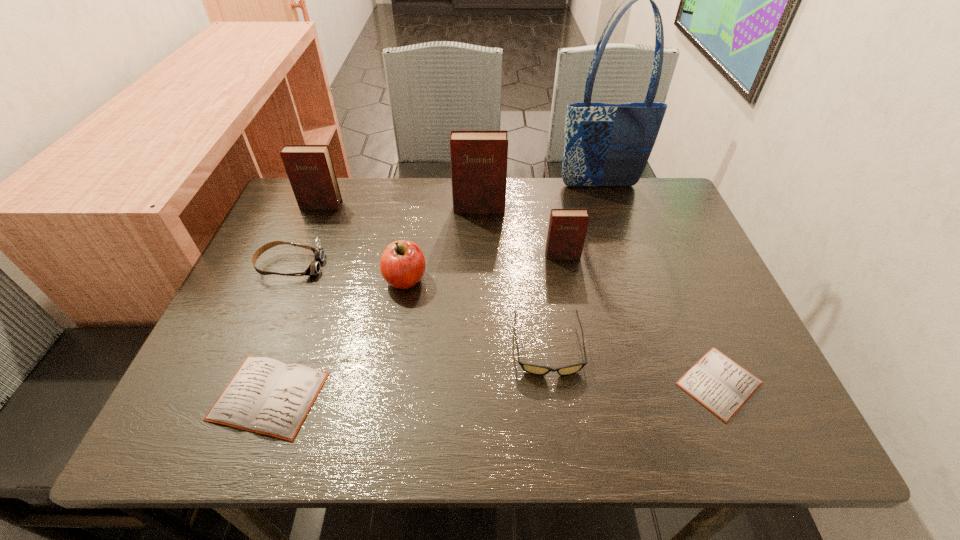
You are a GUI agent. You are given a task and a screenshot of the screen. Output one action in this format:
    pyautogui.click(x=<x>, y=<y>)
    Task: Click on the free space located on the front cover of the sixth shortest object
    
    Given the screenshot: What is the action you would take?
    pyautogui.click(x=576, y=329)

Find the location of a particular element. free point located 0.330m on the left of the apple is located at coordinates point(246,279).

The height and width of the screenshot is (540, 960). Identify the location of free region located 0.170m on the front-facing side of the brown goggles. (392, 266).

Identify the location of free space located on the front-facing side of the sunglasses. (556, 408).

In order to click on vacant space located 0.160m on the back of the bigger white diary in this screenshot , I will do `click(305, 298)`.

At what (x,y) coordinates should I click in order to perform the action: click on vacant area situated on the back of the shortest diary. Please return your answer as a coordinate pair (x, y). Looking at the image, I should click on (685, 303).

The width and height of the screenshot is (960, 540). I want to click on shopping bag that is at the far edge, so click(x=605, y=144).

Locate an element on the screen. This screenshot has width=960, height=540. goggles that is at the left edge is located at coordinates pyautogui.click(x=314, y=268).

At what (x,y) coordinates should I click in order to perform the action: click on shopping bag at the right edge. Please return your answer as a coordinate pair (x, y). Looking at the image, I should click on (605, 144).

The width and height of the screenshot is (960, 540). I want to click on diary present at the right edge, so click(x=721, y=385).